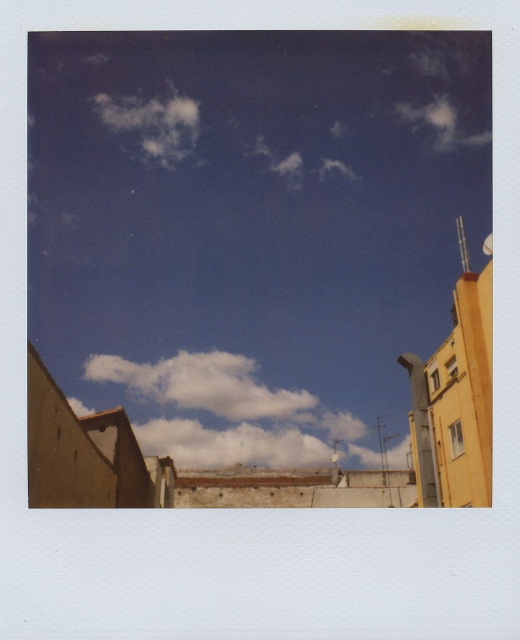
Question: Among these objects, which one is nearest to the camera?

Choices:
 (A) white fluffy cloud at upper left
 (B) white fluffy cloud at center

Answer: (B)

Question: Does white fluffy cloud at center have a lesser width compared to white fluffy cloud at upper left?

Choices:
 (A) yes
 (B) no

Answer: (B)

Question: Is white fluffy cloud at center to the right of white fluffy cloud at upper left from the viewer's perspective?

Choices:
 (A) no
 (B) yes

Answer: (B)

Question: Can you confirm if white fluffy cloud at center is smaller than white fluffy cloud at upper left?

Choices:
 (A) yes
 (B) no

Answer: (B)